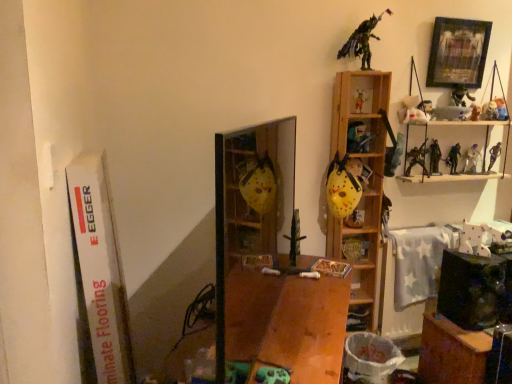
Where is `vacant area that is in front of metallic sword at center, acting as the first toy starting from the left`? vacant area that is in front of metallic sword at center, acting as the first toy starting from the left is located at coordinates (306, 273).